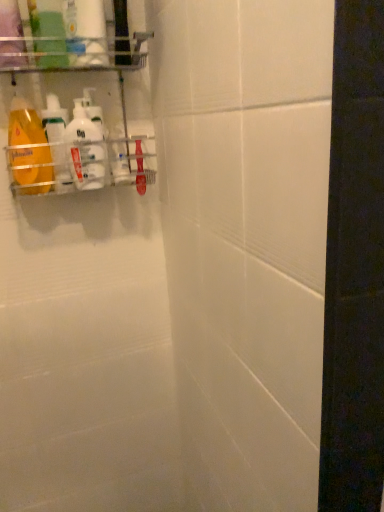
The height and width of the screenshot is (512, 384). What do you see at coordinates (57, 141) in the screenshot?
I see `translucent plastic bottle at left, the 2th cleaning product from the left` at bounding box center [57, 141].

Measure the distance between metallic silver rack at upper left and camera.

metallic silver rack at upper left and camera are 30.14 inches apart from each other.

Identify the location of white glossy bottle at upper left, the fifth cleaning product in the left-to-right sequence. The image size is (384, 512). (94, 110).

The width and height of the screenshot is (384, 512). In order to click on translucent plastic bottle at left, acting as the 4th cleaning product starting from the right in this screenshot , I will do `click(57, 141)`.

Is matte orange bottle at left, the 1th cleaning product in the left-to-right sequence, aimed at white glossy bottle at left, the 3th cleaning product positioned from the right?

No, matte orange bottle at left, the 1th cleaning product in the left-to-right sequence, is not oriented towards white glossy bottle at left, the 3th cleaning product positioned from the right.

Which is more to the right, matte orange bottle at left, the 1th cleaning product in the left-to-right sequence, or white glossy bottle at left, which is the 3th cleaning product in left-to-right order?

white glossy bottle at left, which is the 3th cleaning product in left-to-right order, is more to the right.

Which is less distant, [35,141] or [97,133]?

Point [35,141] is positioned farther from the camera compared to point [97,133].

From the image's perspective, is matte orange bottle at left, the 1th cleaning product in the left-to-right sequence, located above or below white glossy bottle at left, which is the 3th cleaning product in left-to-right order?

matte orange bottle at left, the 1th cleaning product in the left-to-right sequence, is situated higher than white glossy bottle at left, which is the 3th cleaning product in left-to-right order, in the image.

How far apart are white glossy bottle at left, the 3th cleaning product positioned from the right, and translucent plastic bottle at left, acting as the 4th cleaning product starting from the right?

white glossy bottle at left, the 3th cleaning product positioned from the right, is 1.47 inches from translucent plastic bottle at left, acting as the 4th cleaning product starting from the right.

Is white glossy bottle at left, which is the 3th cleaning product in left-to-right order, not close to translucent plastic bottle at left, the 2th cleaning product from the left?

No.

Can you confirm if white glossy bottle at left, the 3th cleaning product positioned from the right, is shorter than translucent plastic bottle at left, acting as the 4th cleaning product starting from the right?

Yes, white glossy bottle at left, the 3th cleaning product positioned from the right, is shorter than translucent plastic bottle at left, acting as the 4th cleaning product starting from the right.

Which object is further away from the camera taking this photo, white glossy bottle at upper left, the fifth cleaning product in the left-to-right sequence, or translucent plastic bottle at left, acting as the 4th cleaning product starting from the right?

white glossy bottle at upper left, the fifth cleaning product in the left-to-right sequence, is further away from the camera.

Which point is more distant from viewer, [107,150] or [55,135]?

The point [107,150] is more distant.

From their relative heights in the image, would you say white glossy bottle at upper left, the first cleaning product from the right, is taller or shorter than translucent plastic bottle at left, the 2th cleaning product from the left?

Clearly, white glossy bottle at upper left, the first cleaning product from the right, is taller compared to translucent plastic bottle at left, the 2th cleaning product from the left.

Can you see metallic silver rack at upper left touching matte orange bottle at left, the 1th cleaning product in the left-to-right sequence?

metallic silver rack at upper left and matte orange bottle at left, the 1th cleaning product in the left-to-right sequence, are clearly separated.

Which object is closer to the camera taking this photo, metallic silver rack at upper left or matte orange bottle at left, which is the fifth cleaning product in right-to-left order?

Positioned in front is metallic silver rack at upper left.

Which is in front, point (13, 140) or point (22, 106)?

The point (22, 106) is more forward.

How much distance is there between metallic silver rack at upper left and matte orange bottle at left, the 1th cleaning product in the left-to-right sequence?

The distance of metallic silver rack at upper left from matte orange bottle at left, the 1th cleaning product in the left-to-right sequence, is 4.36 inches.

Is white glossy bottle at upper left, the fourth cleaning product when ordered from left to right, wider than white glossy bottle at left, the 3th cleaning product positioned from the right?

Correct, the width of white glossy bottle at upper left, the fourth cleaning product when ordered from left to right, exceeds that of white glossy bottle at left, the 3th cleaning product positioned from the right.

From the image's perspective, which is above, white glossy bottle at upper left, which is the second cleaning product from right to left, or white glossy bottle at left, which is the 3th cleaning product in left-to-right order?

white glossy bottle at upper left, which is the second cleaning product from right to left, from the image's perspective.

Find the location of a particular element. cleaning product that is the 4th object located above the white glossy bottle at left, which is the 3th cleaning product in left-to-right order (from the image's perspective) is located at coordinates (86, 32).

Between white glossy bottle at upper left, the fourth cleaning product when ordered from left to right, and white glossy bottle at left, which is the 3th cleaning product in left-to-right order, which one has smaller size?

Smaller between the two is white glossy bottle at left, which is the 3th cleaning product in left-to-right order.

Is white glossy bottle at upper left, the fifth cleaning product in the left-to-right sequence, thinner than metallic silver rack at upper left?

Indeed, white glossy bottle at upper left, the fifth cleaning product in the left-to-right sequence, has a lesser width compared to metallic silver rack at upper left.

From the image's perspective, is white glossy bottle at upper left, the fifth cleaning product in the left-to-right sequence, below metallic silver rack at upper left?

Yes.

Is white glossy bottle at upper left, the fifth cleaning product in the left-to-right sequence, behind metallic silver rack at upper left?

Yes, it is.

Does white glossy bottle at upper left, the first cleaning product from the right, touch metallic silver rack at upper left?

Yes, the surface of white glossy bottle at upper left, the first cleaning product from the right, is in contact with metallic silver rack at upper left.

What are the coordinates of `the 2nd cleaning product counting from the left side of the white glossy bottle at upper left, the first cleaning product from the right` in the screenshot? It's located at (85, 150).

Between white glossy bottle at upper left, the fifth cleaning product in the left-to-right sequence, and white glossy bottle at left, which is the 3th cleaning product in left-to-right order, which one has smaller width?

Thinner between the two is white glossy bottle at upper left, the fifth cleaning product in the left-to-right sequence.

Is point (106, 169) positioned after point (79, 152)?

Yes, point (106, 169) is farther from viewer.

The image size is (384, 512). I want to click on the 2nd cleaning product to the left of the white glossy bottle at left, the 3th cleaning product positioned from the right, starting your count from the anchor, so click(x=28, y=149).

You are a GUI agent. You are given a task and a screenshot of the screen. Output one action in this format:
    pyautogui.click(x=<x>, y=<y>)
    Task: Click on the 1st cleaning product in front of the translucent plastic bottle at left, the 2th cleaning product from the left, counting from the anchor's position
    The width and height of the screenshot is (384, 512).
    Given the screenshot: What is the action you would take?
    pyautogui.click(x=85, y=150)

From the image, which object appears to be nearer to translucent plastic bottle at left, acting as the 4th cleaning product starting from the right, metallic silver rack at upper left or matte orange bottle at left, which is the fifth cleaning product in right-to-left order?

The object closer to translucent plastic bottle at left, acting as the 4th cleaning product starting from the right, is matte orange bottle at left, which is the fifth cleaning product in right-to-left order.

Based on their spatial positions, is white glossy bottle at upper left, the fifth cleaning product in the left-to-right sequence, or translucent plastic bottle at left, acting as the 4th cleaning product starting from the right, closer to matte orange bottle at left, which is the fifth cleaning product in right-to-left order?

translucent plastic bottle at left, acting as the 4th cleaning product starting from the right, lies closer to matte orange bottle at left, which is the fifth cleaning product in right-to-left order, than the other object.

Looking at the image, which one is located closer to white glossy bottle at upper left, the fifth cleaning product in the left-to-right sequence, white glossy bottle at upper left, the fourth cleaning product when ordered from left to right, or metallic silver rack at upper left?

Among the two, metallic silver rack at upper left is located nearer to white glossy bottle at upper left, the fifth cleaning product in the left-to-right sequence.

From the image, which object appears to be nearer to matte orange bottle at left, which is the fifth cleaning product in right-to-left order, translucent plastic bottle at left, the 2th cleaning product from the left, or metallic silver rack at upper left?

Among the two, translucent plastic bottle at left, the 2th cleaning product from the left, is located nearer to matte orange bottle at left, which is the fifth cleaning product in right-to-left order.

Consider the image. From the image, which object appears to be farther from white glossy bottle at upper left, the fifth cleaning product in the left-to-right sequence, white glossy bottle at left, which is the 3th cleaning product in left-to-right order, or translucent plastic bottle at left, the 2th cleaning product from the left?

translucent plastic bottle at left, the 2th cleaning product from the left, lies further to white glossy bottle at upper left, the fifth cleaning product in the left-to-right sequence, than the other object.

Which object lies further to the anchor point white glossy bottle at left, the 3th cleaning product positioned from the right, translucent plastic bottle at left, acting as the 4th cleaning product starting from the right, or matte orange bottle at left, the 1th cleaning product in the left-to-right sequence?

matte orange bottle at left, the 1th cleaning product in the left-to-right sequence.

Based on the photo, which object lies further to the anchor point translucent plastic bottle at left, the 2th cleaning product from the left, white glossy bottle at upper left, the fifth cleaning product in the left-to-right sequence, or matte orange bottle at left, which is the fifth cleaning product in right-to-left order?

white glossy bottle at upper left, the fifth cleaning product in the left-to-right sequence.

Looking at the image, which one is located closer to matte orange bottle at left, the 1th cleaning product in the left-to-right sequence, white glossy bottle at upper left, the fourth cleaning product when ordered from left to right, or white glossy bottle at upper left, the first cleaning product from the right?

Based on the image, white glossy bottle at upper left, the first cleaning product from the right, appears to be nearer to matte orange bottle at left, the 1th cleaning product in the left-to-right sequence.

Where is `shelf between white glossy bottle at upper left, the fourth cleaning product when ordered from left to right, and white glossy bottle at left, the 3th cleaning product positioned from the right, vertically`? shelf between white glossy bottle at upper left, the fourth cleaning product when ordered from left to right, and white glossy bottle at left, the 3th cleaning product positioned from the right, vertically is located at coordinates (75, 97).

Where is `cleaning product between white glossy bottle at upper left, the fourth cleaning product when ordered from left to right, and translucent plastic bottle at left, acting as the 4th cleaning product starting from the right, in the vertical direction`? Image resolution: width=384 pixels, height=512 pixels. cleaning product between white glossy bottle at upper left, the fourth cleaning product when ordered from left to right, and translucent plastic bottle at left, acting as the 4th cleaning product starting from the right, in the vertical direction is located at coordinates (94, 110).

Where is `shelf that lies between white glossy bottle at upper left, which is the second cleaning product from right to left, and matte orange bottle at left, the 1th cleaning product in the left-to-right sequence, from top to bottom`? The height and width of the screenshot is (512, 384). shelf that lies between white glossy bottle at upper left, which is the second cleaning product from right to left, and matte orange bottle at left, the 1th cleaning product in the left-to-right sequence, from top to bottom is located at coordinates (75, 97).

Identify the location of cleaning product between matte orange bottle at left, which is the fifth cleaning product in right-to-left order, and white glossy bottle at left, the 3th cleaning product positioned from the right. (57, 141).